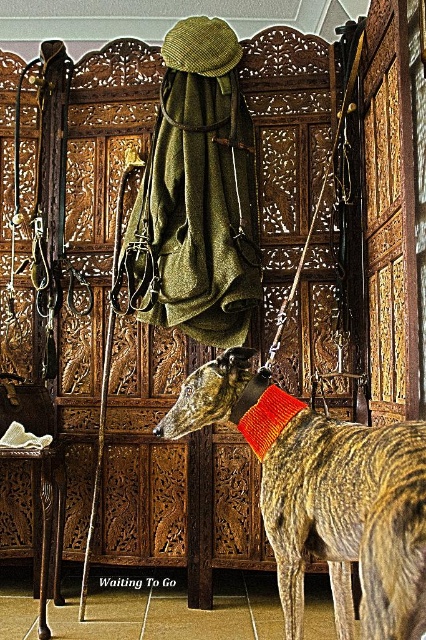
You are a dog trainer assessing the setup for a training session. You need to ensure the orange knitted neckband at center is visible above the striped fur dog at center. Based on the scene description, will the neckband be visible above the dog?

The striped fur dog at center has a greater height compared to the orange knitted neckband at center. Therefore, the neckband may be partially or fully obscured by the dog, making it less visible above the dog.

You are an animal trainer observing the striped fur dog at center and the orange knitted neckband at center. Which object is closer to you?

Result: The striped fur dog at center is closer to you because it is in front of the orange knitted neckband at center.

You are an interior designer assessing the placement of items in a room. You notice the striped fur dog at center and the orange knitted neckband at center. Which object is located to the right of the other?

The striped fur dog at center is positioned to the right of the orange knitted neckband at center.